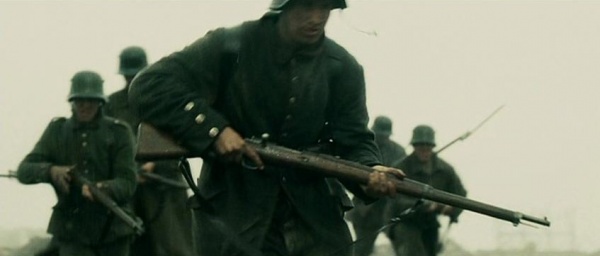
You are a GUI agent. You are given a task and a screenshot of the screen. Output one action in this format:
    pyautogui.click(x=<x>, y=<y>)
    Task: Click on the chest
    
    Given the screenshot: What is the action you would take?
    pyautogui.click(x=280, y=87), pyautogui.click(x=431, y=173), pyautogui.click(x=382, y=151), pyautogui.click(x=124, y=107), pyautogui.click(x=88, y=138)